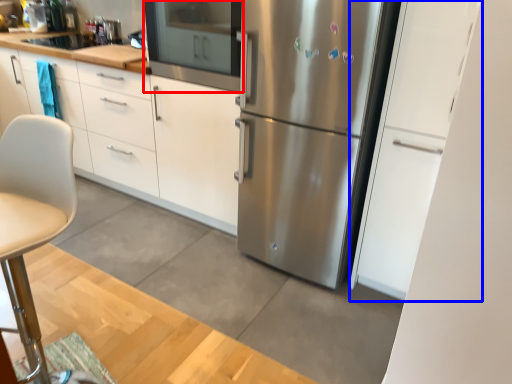
Question: Which of the following is the closest to the observer, oven (highlighted by a red box) or cabinetry (highlighted by a blue box)?

Choices:
 (A) oven
 (B) cabinetry

Answer: (B)